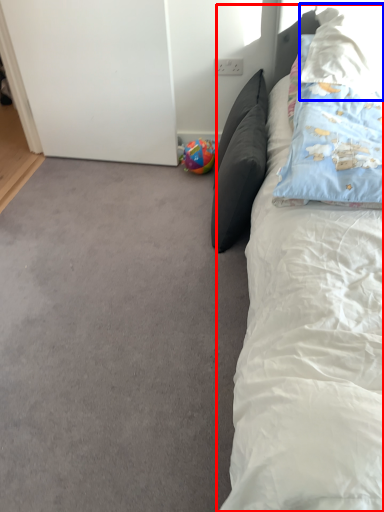
Question: Which object is closer to the camera taking this photo, bed (highlighted by a red box) or pillow (highlighted by a blue box)?

Choices:
 (A) bed
 (B) pillow

Answer: (A)